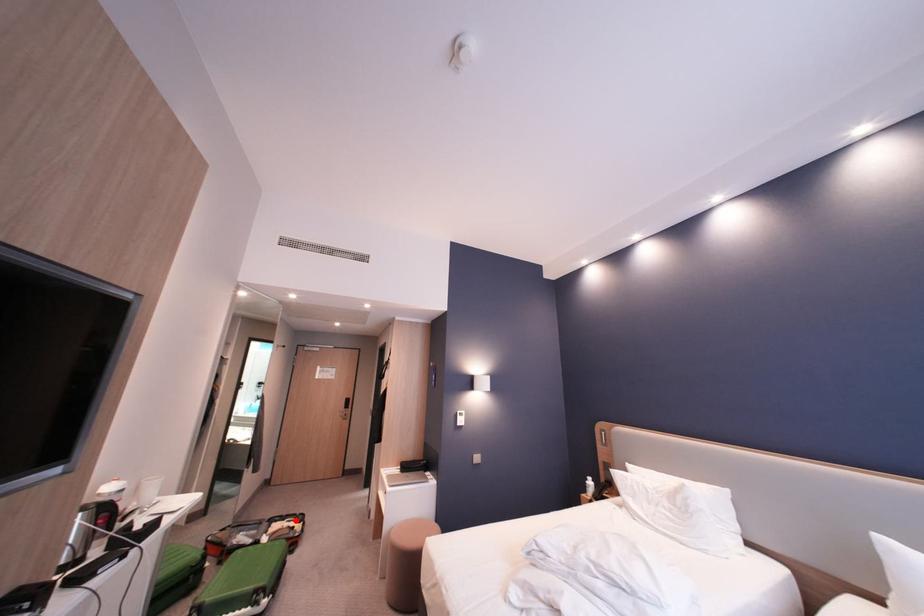
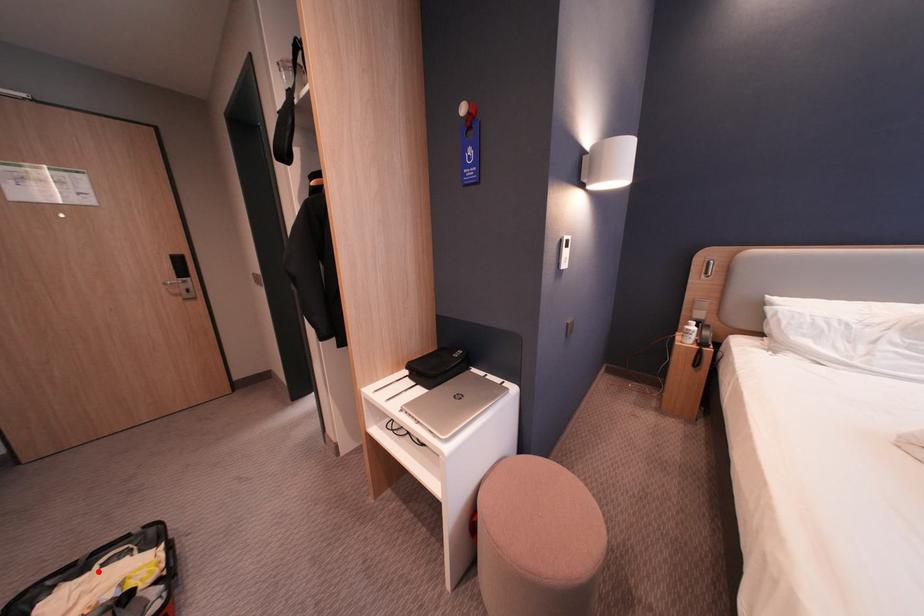
I am providing you with two images of the same scene from different viewpoints. A red point is marked on the first image and another point is marked on the second image. Is the marked point in image1 the same physical position as the marked point in image2?

Yes